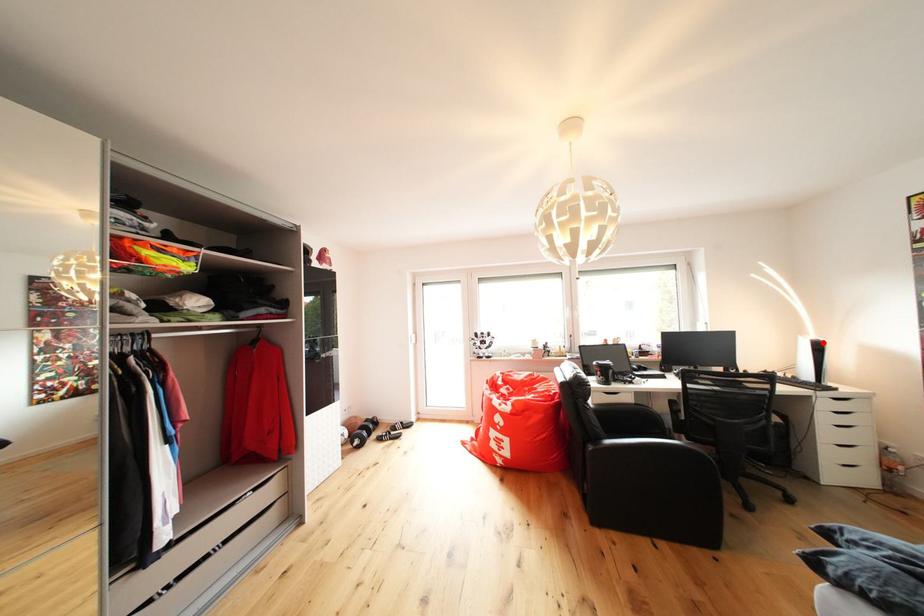
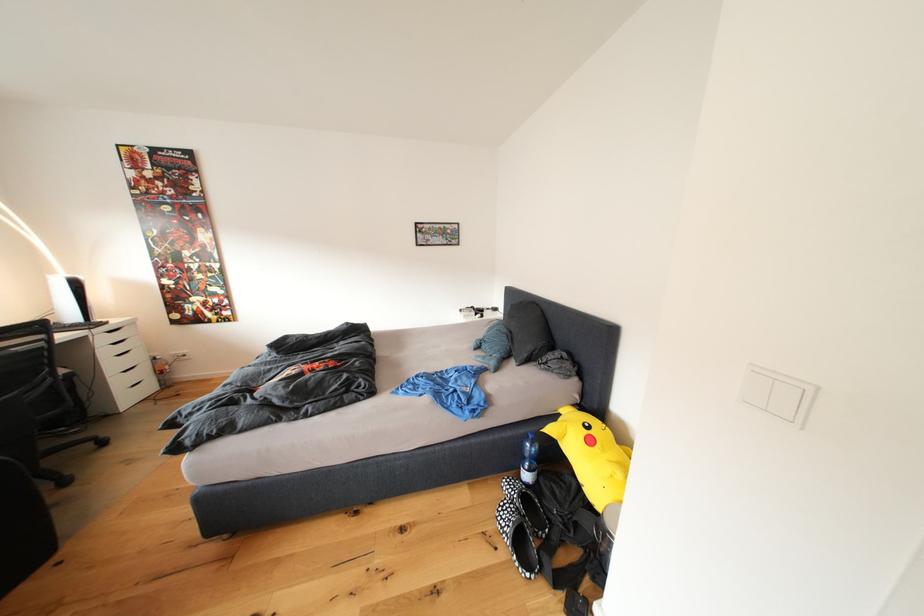
Question: I am providing you with two images of the same scene from different viewpoints. Image1 has a red point marked. In image2, the corresponding 3D location appears at what relative position? Reply with the corresponding letter.

Choices:
 (A) Closer
 (B) Farther

Answer: (B)